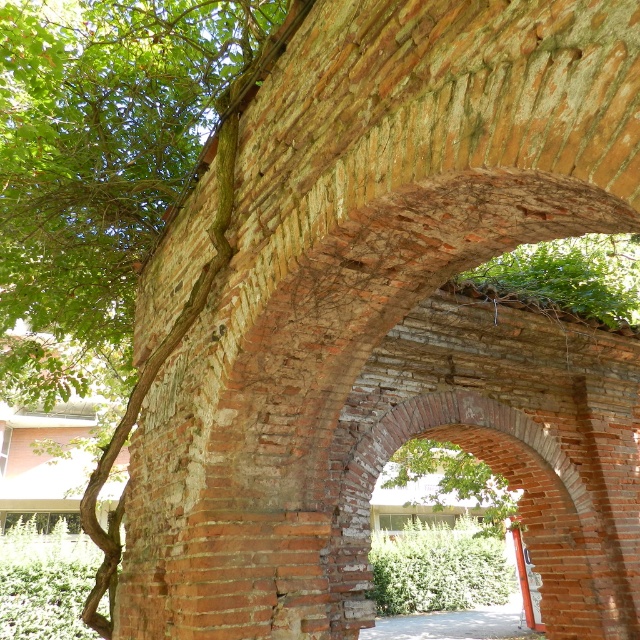
Who is lower down, green leafy tree at upper left or green leafy tree at center?

green leafy tree at center

Can you confirm if green leafy tree at upper left is positioned below green leafy tree at center?

No, green leafy tree at upper left is not below green leafy tree at center.

Which is behind, point (125, 99) or point (483, 472)?

Point (483, 472)

This screenshot has width=640, height=640. What are the coordinates of `green leafy tree at upper left` in the screenshot? It's located at (100, 163).

Measure the distance between point (225, 28) and camera.

4.30 meters

The height and width of the screenshot is (640, 640). I want to click on green leafy tree at upper left, so click(x=100, y=163).

Is point (36, 10) positioned before point (520, 541)?

Yes.

You are a GUI agent. You are given a task and a screenshot of the screen. Output one action in this format:
    pyautogui.click(x=<x>, y=<y>)
    Task: Click on the green leafy tree at upper left
    The image size is (640, 640).
    Given the screenshot: What is the action you would take?
    pyautogui.click(x=100, y=163)

Which of these two, green leafy tree at center or orange painted wood post at center, stands taller?

With more height is orange painted wood post at center.

Can you confirm if green leafy tree at center is shorter than orange painted wood post at center?

Correct, green leafy tree at center is not as tall as orange painted wood post at center.

Is point (458, 486) closer to camera compared to point (518, 582)?

Yes, it is in front of point (518, 582).

This screenshot has height=640, width=640. In order to click on green leafy tree at center in this screenshot , I will do `click(452, 481)`.